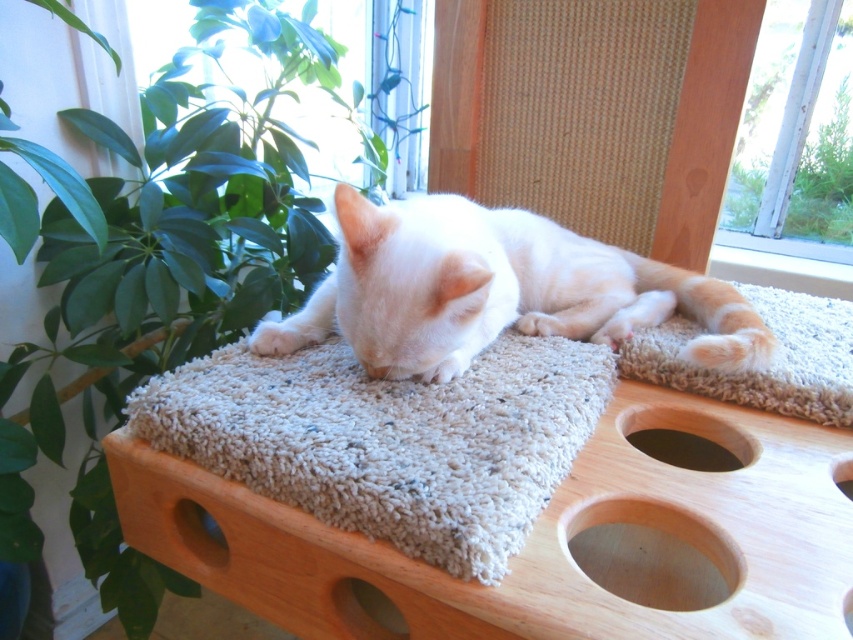
Does beige shaggy carpet at center have a greater height compared to smooth dark wood hole at lower center?

Yes, beige shaggy carpet at center is taller than smooth dark wood hole at lower center.

Is beige shaggy carpet at center to the right of smooth dark wood hole at lower center from the viewer's perspective?

In fact, beige shaggy carpet at center is to the left of smooth dark wood hole at lower center.

This screenshot has width=853, height=640. What do you see at coordinates (390, 440) in the screenshot?
I see `beige shaggy carpet at center` at bounding box center [390, 440].

The width and height of the screenshot is (853, 640). Find the location of `beige shaggy carpet at center`. beige shaggy carpet at center is located at coordinates (390, 440).

Is the position of orange striped fur at center more distant than that of smooth light brown wooden hole at lower center?

Yes, orange striped fur at center is behind smooth light brown wooden hole at lower center.

Does point (677, 316) lie in front of point (611, 547)?

No, (677, 316) is further to viewer.

At what (x,y) coordinates should I click in order to perform the action: click on orange striped fur at center. Please return your answer as a coordinate pair (x, y). This screenshot has height=640, width=853. Looking at the image, I should click on (772, 360).

Which is behind, point (729, 394) or point (724, 465)?

Positioned behind is point (724, 465).

Image resolution: width=853 pixels, height=640 pixels. I want to click on orange striped fur at center, so click(x=772, y=360).

The image size is (853, 640). Describe the element at coordinates (772, 360) in the screenshot. I see `orange striped fur at center` at that location.

At what (x,y) coordinates should I click in order to perform the action: click on orange striped fur at center. Please return your answer as a coordinate pair (x, y). The width and height of the screenshot is (853, 640). Looking at the image, I should click on (772, 360).